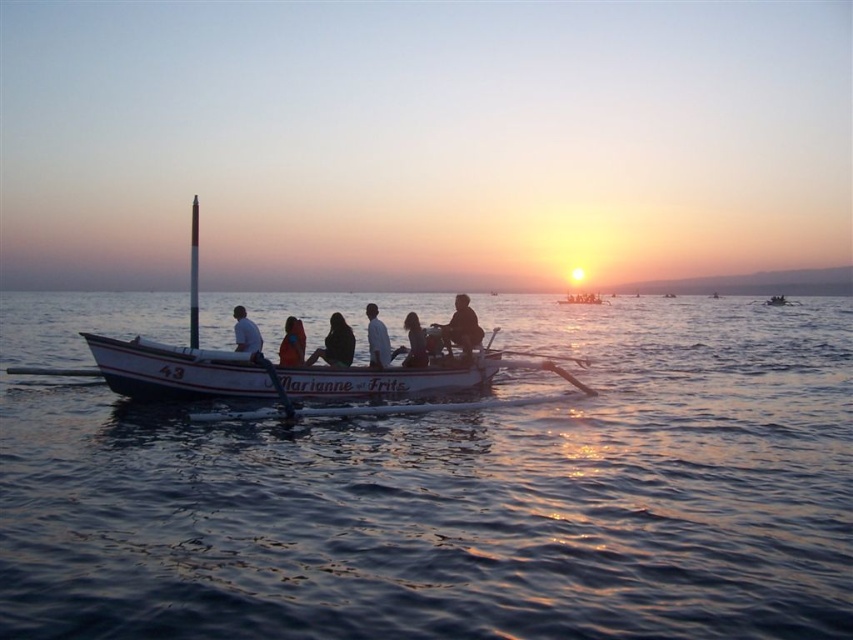
You are a photographer trying to capture the sunset reflection on the water. You notice a white cotton shirt at center in the scene. Based on its position, can you estimate whether the shirt is closer to the water surface or the boat? Please explain your reasoning.

The white cotton shirt at center is located at point coordinates of 0.530 on the x axis and 0.442 on the y axis. Since the boat is in the foreground and the water surface is lower in the image, the shirt is closer to the boat than the water surface.

You are a photographer taking a picture of the sunset scene. You notice two shirts on the boat named Marianne with the number 43. The white cotton shirt at center and the matte black shirt at center. Which shirt is visible on top?

The white cotton shirt at center is positioned over matte black shirt at center, so the white cotton shirt at center is visible on top.